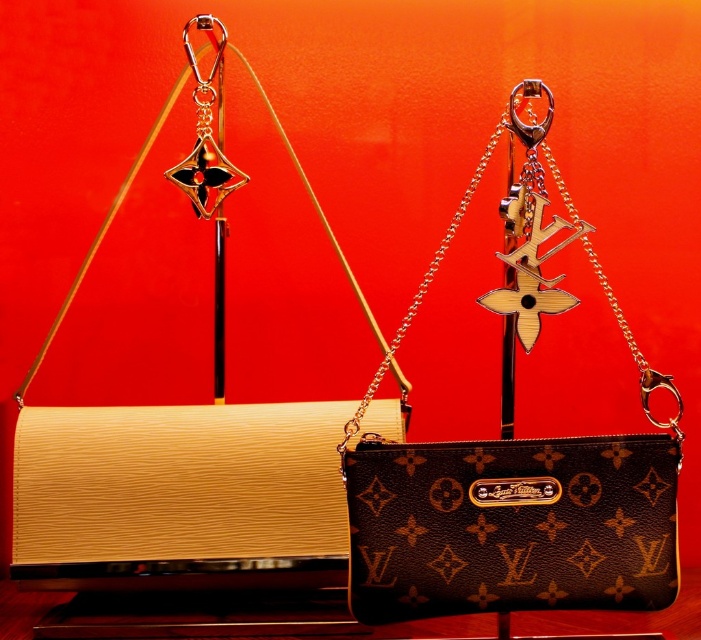
Who is lower down, brown monogrammed leather handbag at center or metallic gold hook at upper center?

brown monogrammed leather handbag at center is lower down.

Can you confirm if brown monogrammed leather handbag at center is shorter than metallic gold hook at upper center?

Indeed, brown monogrammed leather handbag at center has a lesser height compared to metallic gold hook at upper center.

Locate an element on the screen. brown monogrammed leather handbag at center is located at coordinates (510, 525).

The width and height of the screenshot is (701, 640). Find the location of `brown monogrammed leather handbag at center`. brown monogrammed leather handbag at center is located at coordinates (510, 525).